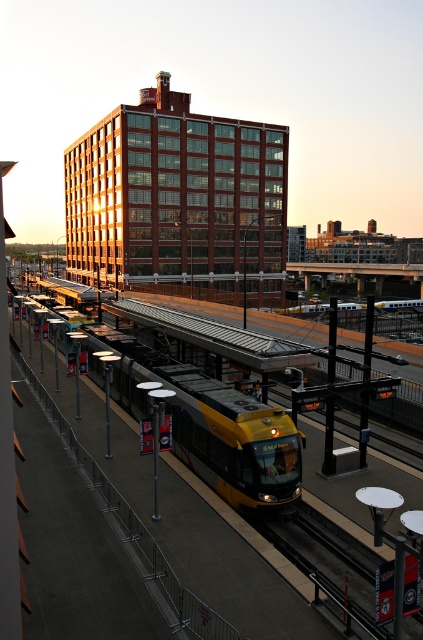
You are a maintenance worker checking the train tracks. You see the yellow metallic train at center and the metallic smooth train track at lower center. Which object is closer to you?

The yellow metallic train at center is closer to you because the metallic smooth train track at lower center is behind it.

You are a pedestrian standing on the platform at the train station. You see the yellow metallic train at center and the metallic smooth train track at lower center. Which object is closer to your left side?

The yellow metallic train at center is closer to your left side because it is positioned to the left of the metallic smooth train track at lower center.